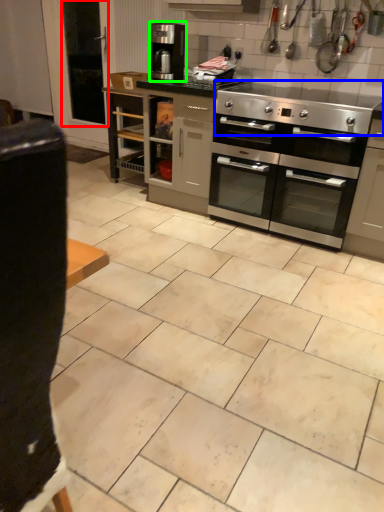
Question: Which object is the closest to the screen door (highlighted by a red box)? Choose among these: gas stove (highlighted by a blue box) or coffee maker (highlighted by a green box).

Choices:
 (A) gas stove
 (B) coffee maker

Answer: (B)